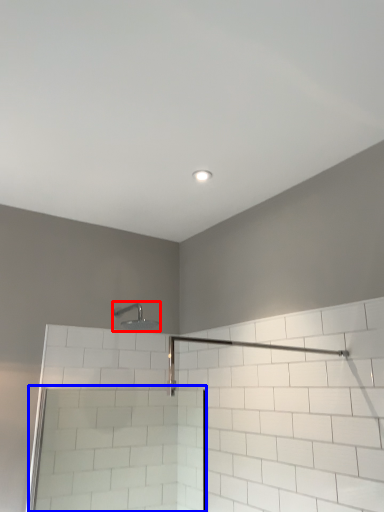
Question: Which object appears farthest to the camera in this image, shower (highlighted by a red box) or screen door (highlighted by a blue box)?

Choices:
 (A) shower
 (B) screen door

Answer: (A)